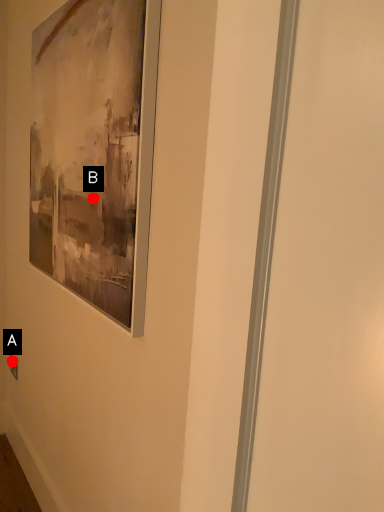
Question: Two points are circled on the image, labeled by A and B beside each circle. Which point is farther from the camera taking this photo?

Choices:
 (A) A is further
 (B) B is further

Answer: (A)